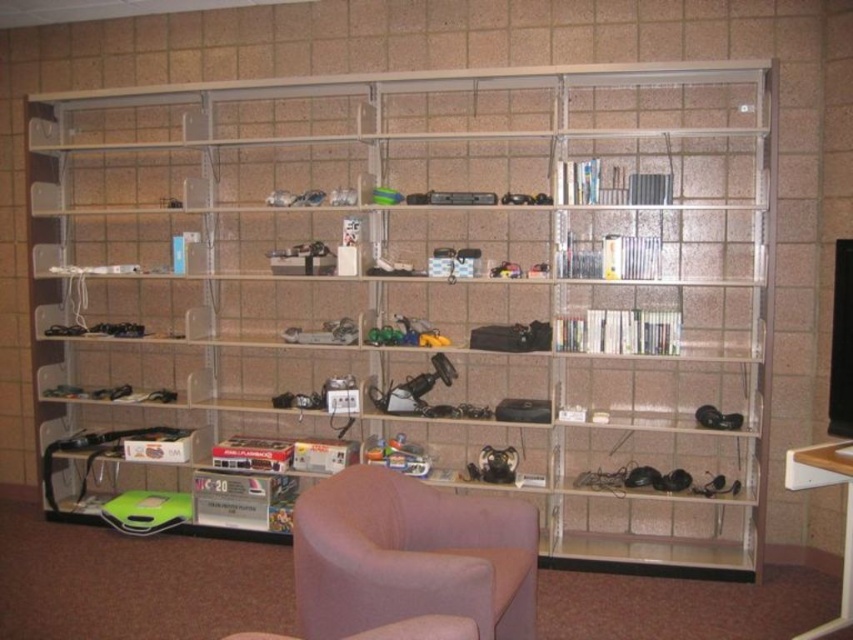
You are standing in front of the shelving unit and want to reach an item located at point (628, 460). If your maximum reaching height is 6 feet, can you safely retrieve it?

The point (628, 460) is 13.33 feet away from the viewer, which is beyond the maximum reaching height of 6 feet. You cannot safely retrieve it.

Consider the image. You are organizing the storage room and need to place a new item on the shelf. The clear plastic bookcase at center and the pink fabric swivel chair at lower center are in your way. Which object should you move to the right to make space?

You should move the pink fabric swivel chair at lower center to the right because the clear plastic bookcase at center is already to the left of it, so moving the chair right would create space on the left side.

You are organizing a tech storage area and need to place a new item on the shelf. The item requires a space wider than the pink fabric swivel chair at lower center. Can the clear plastic bookcase at center accommodate this item?

The clear plastic bookcase at center has a width larger than the pink fabric swivel chair at lower center, so it can accommodate an item requiring a space wider than the pink fabric swivel chair at lower center.